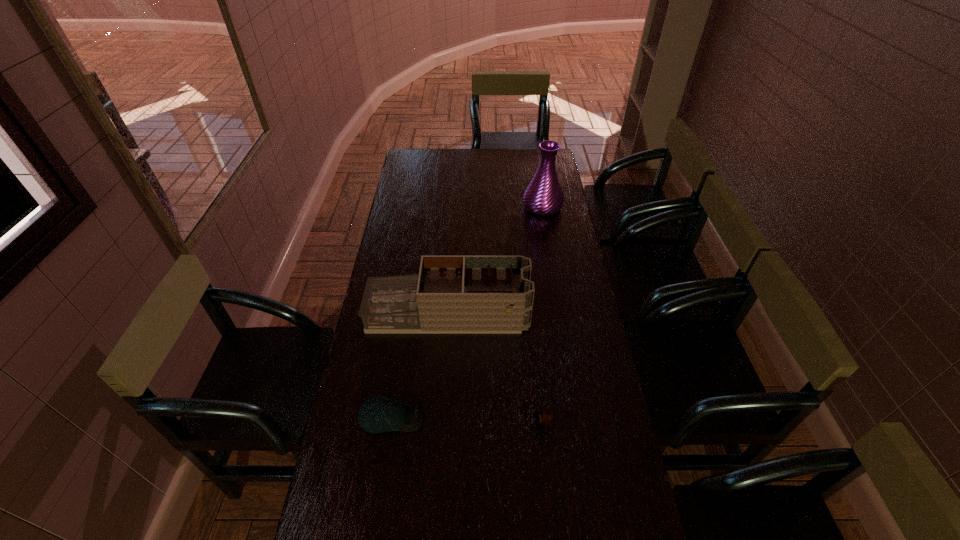
Image resolution: width=960 pixels, height=540 pixels. In order to click on vacant area between the teddy bear and the third nearest object in this screenshot , I will do `click(495, 369)`.

Locate an element on the screen. The image size is (960, 540). free space between the vase and the teddy bear is located at coordinates click(x=542, y=315).

This screenshot has width=960, height=540. I want to click on unoccupied area between the baseball cap and the teddy bear, so click(467, 421).

What are the coordinates of `free space between the teddy bear and the dollhouse` in the screenshot? It's located at (x=495, y=369).

The height and width of the screenshot is (540, 960). I want to click on blank region between the teddy bear and the dollhouse, so click(495, 369).

Identify the location of object that is the second closest one to the teddy bear. The width and height of the screenshot is (960, 540). (379, 414).

Where is `object identified as the second closest to the baseball cap`? This screenshot has height=540, width=960. object identified as the second closest to the baseball cap is located at coordinates (545, 416).